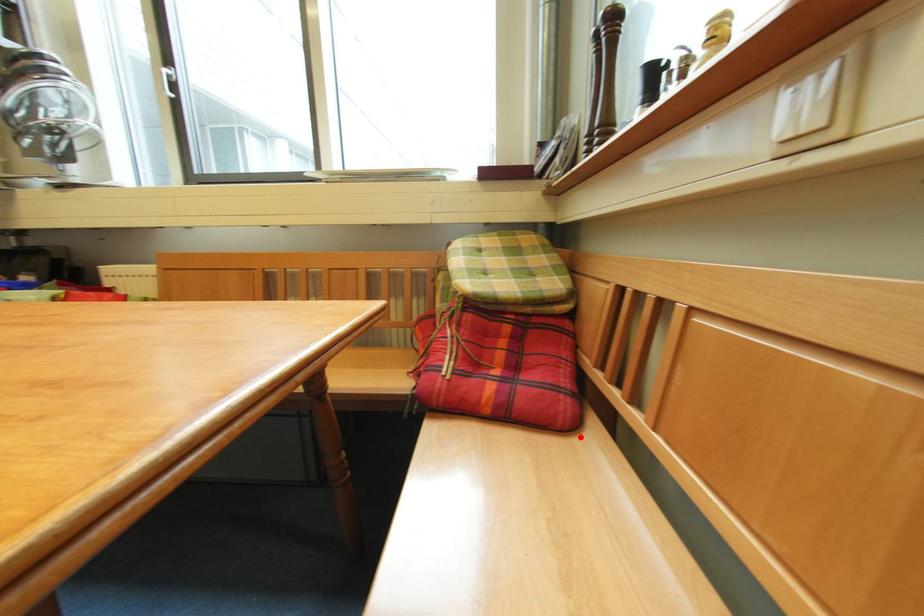
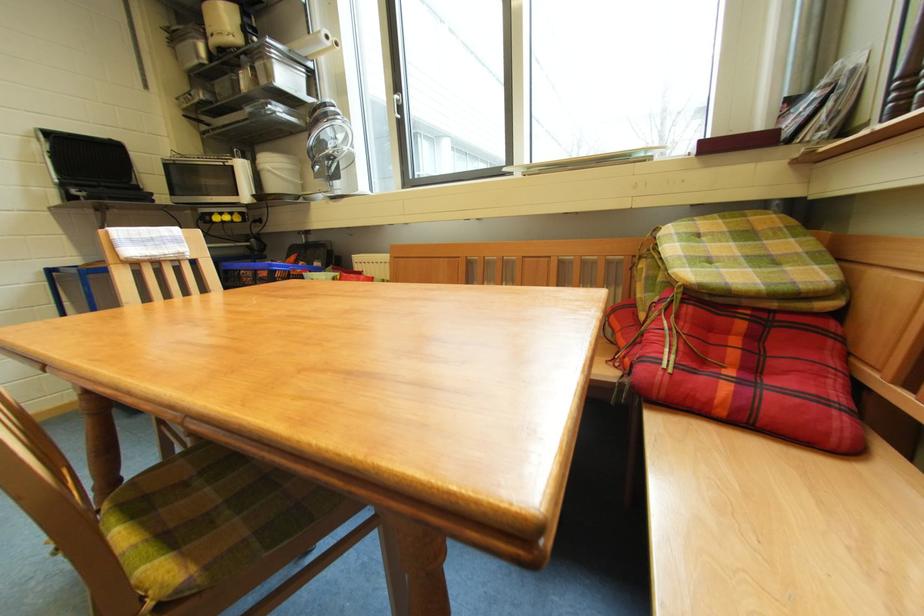
Locate, in the second image, the point that corresponds to the highlighted location in the first image.

(864, 463)